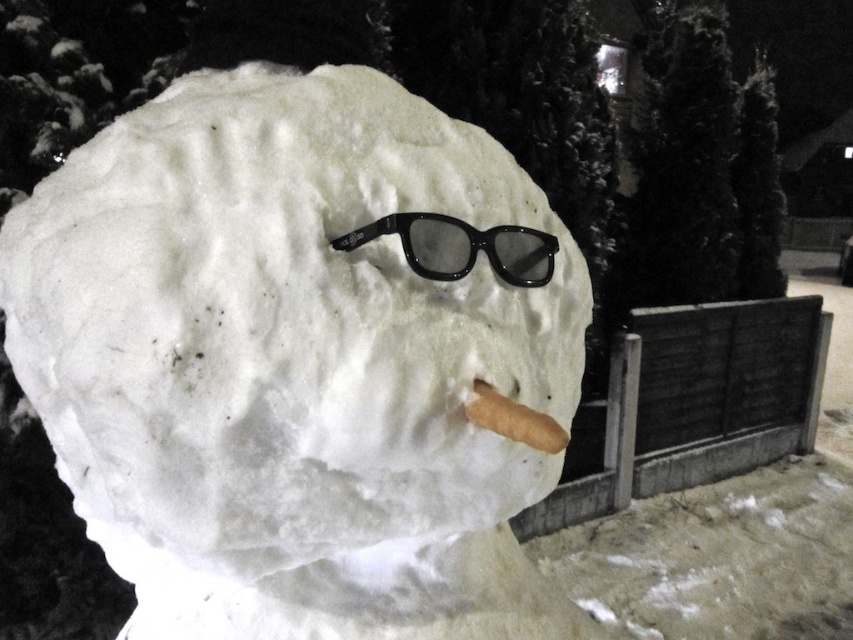
Is white fluffy snowman at center closer to camera compared to black plastic goggles at center?

Yes.

Is white fluffy snowman at center above black plastic goggles at center?

No, white fluffy snowman at center is not above black plastic goggles at center.

Which is in front, point (12, 353) or point (355, 246)?

Point (355, 246) is in front.

Locate an element on the screen. The image size is (853, 640). white fluffy snowman at center is located at coordinates (293, 362).